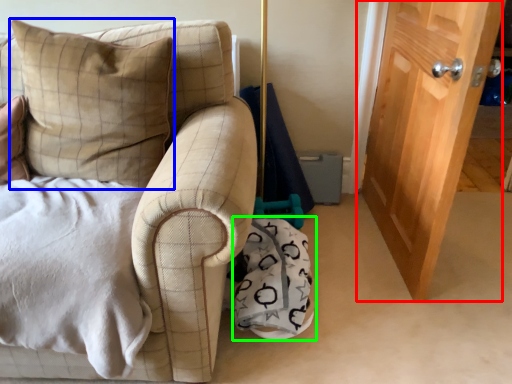
Question: Which object is positioned closest to door (highlighted by a red box)? Select from pillow (highlighted by a blue box) and material (highlighted by a green box).

Choices:
 (A) pillow
 (B) material

Answer: (B)